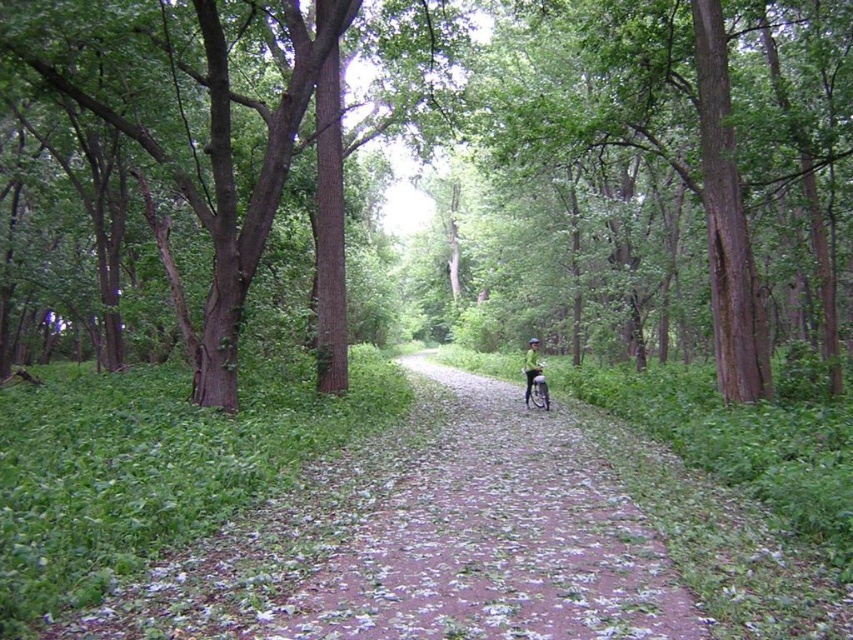
From the picture: You are standing at the camera position and want to walk to the brown dirt path at center. What direction should you move to reach it?

To reach the brown dirt path at center, you should move towards the center of the image since it is located at point coordinates (495, 541).

You are standing at the edge of the forest and see the brown rough tree at center and the brown dirt path at center. Which object is closer to you?

The brown rough tree at center is closer to you because the brown dirt path at center is behind it.